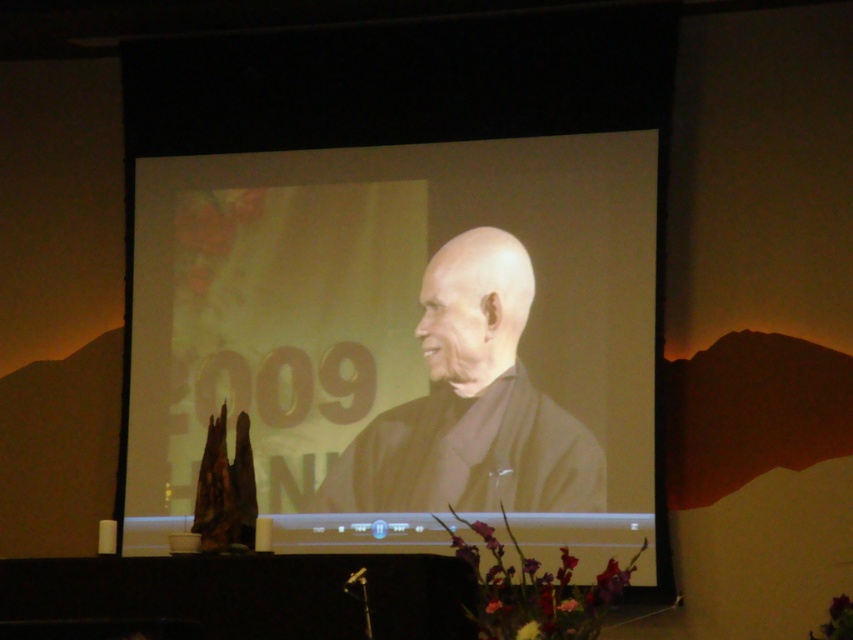
This screenshot has width=853, height=640. In order to click on matte black screen at center in this screenshot , I will do `click(399, 342)`.

Between matte black screen at center and black matte kimono at center, which one has more height?

matte black screen at center is taller.

This screenshot has width=853, height=640. What do you see at coordinates (399, 342) in the screenshot? I see `matte black screen at center` at bounding box center [399, 342].

This screenshot has width=853, height=640. Find the location of `matte black screen at center`. matte black screen at center is located at coordinates (399, 342).